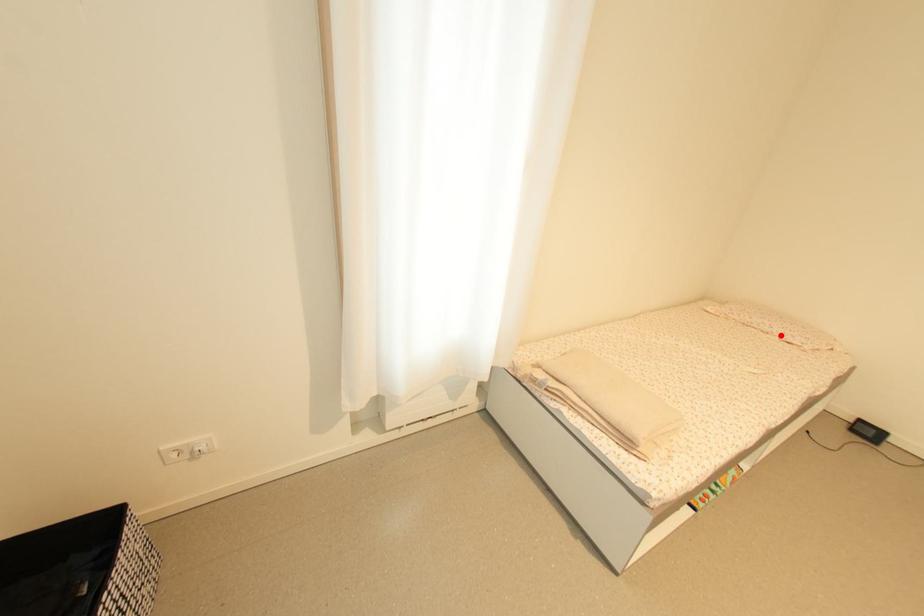
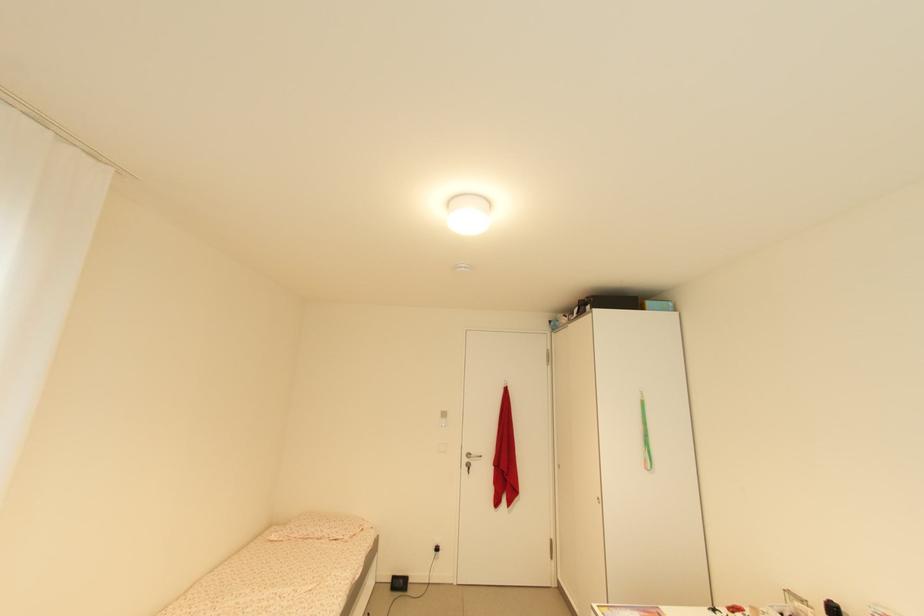
Question: A red point is marked in image1. In image2, is the corresponding 3D point closer to the camera or farther? Reply with the corresponding letter.

Choices:
 (A) The corresponding 3D point is closer.
 (B) The corresponding 3D point is farther.

Answer: (B)